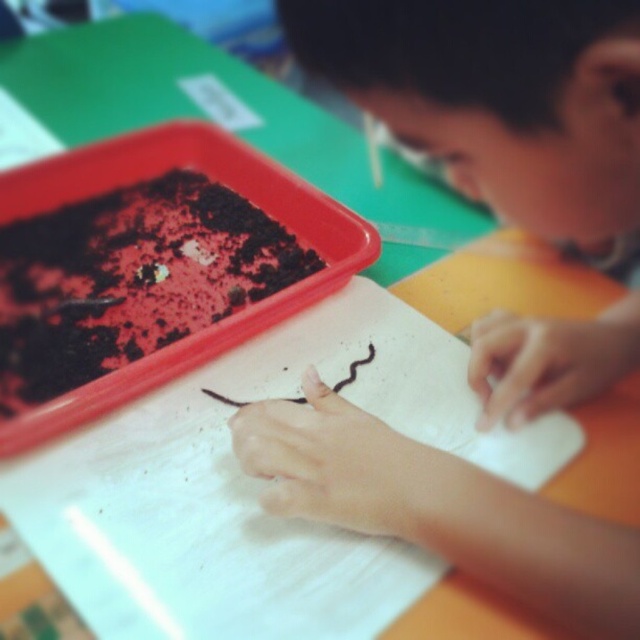
Question: Is smooth skin boy at center behind chocolate cake at center?

Choices:
 (A) yes
 (B) no

Answer: (B)

Question: Is smooth skin boy at center wider than chocolate cake at center?

Choices:
 (A) no
 (B) yes

Answer: (A)

Question: Which of the following is the farthest from the observer?

Choices:
 (A) (81, 328)
 (B) (548, 113)

Answer: (A)

Question: Is smooth skin boy at center smaller than chocolate cake at center?

Choices:
 (A) no
 (B) yes

Answer: (A)

Question: Among these points, which one is nearest to the camera?

Choices:
 (A) (513, 403)
 (B) (168, 333)

Answer: (A)